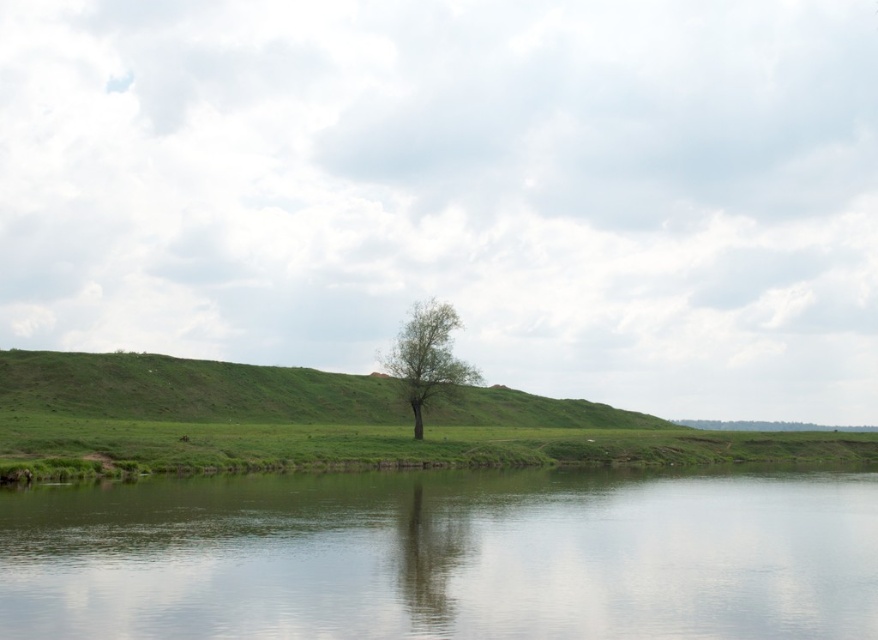
Which is in front, point (610, 548) or point (426, 339)?

Point (610, 548) is more forward.

Who is higher up, green smooth water at center or green leafy tree at center?

green leafy tree at center is higher up.

Is point (864, 554) in front of point (398, 356)?

Yes, point (864, 554) is closer to viewer.

The height and width of the screenshot is (640, 878). What are the coordinates of `green smooth water at center` in the screenshot? It's located at (445, 557).